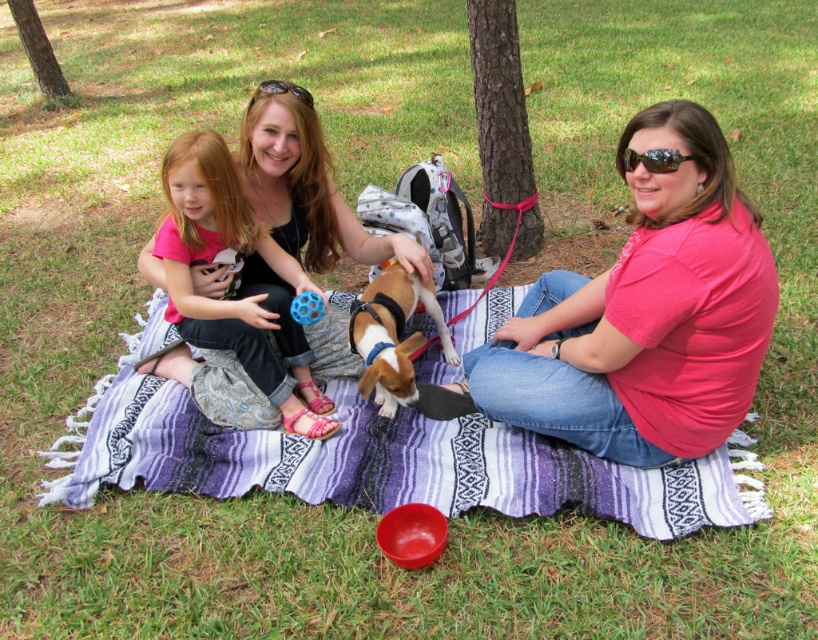
You are a photographer trying to capture a closeup of the pink fabric at center. There is a pink matte shirt at center in the way. Which object should you move to get a clear shot?

The pink matte shirt at center is positioned on the right side of the pink fabric at center. To get a clear shot of the pink fabric at center, you should move the pink matte shirt at center to the left.